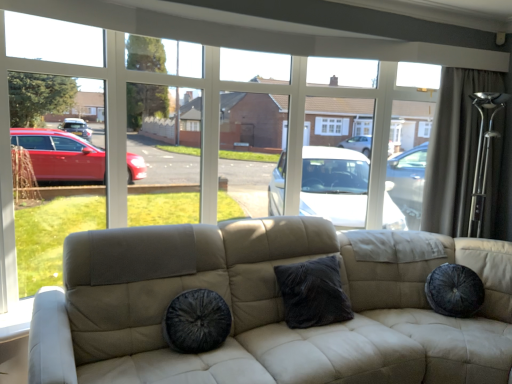
Find the location of a particular element. The height and width of the screenshot is (384, 512). velvet dark gray pillow at center is located at coordinates (313, 293).

The image size is (512, 384). I want to click on dark gray fabric curtain at upper right, so click(454, 149).

What do you see at coordinates (196, 321) in the screenshot? I see `velvet black dog bed at center` at bounding box center [196, 321].

This screenshot has width=512, height=384. In order to click on velvet dark gray pillow at center in this screenshot , I will do `click(313, 293)`.

Between dark gray fabric curtain at upper right and velvet black dog bed at center, which one has more height?

With more height is dark gray fabric curtain at upper right.

Does point (468, 129) appear closer or farther from the camera than point (211, 340)?

Point (468, 129).

Is point (448, 210) positioned after point (331, 291)?

Yes, it is.

Which of these two, dark gray fabric curtain at upper right or velvet dark gray pillow at center, stands shorter?

velvet dark gray pillow at center.

Based on their sizes in the image, would you say dark gray fabric curtain at upper right is bigger or smaller than velvet dark gray pillow at center?

Clearly, dark gray fabric curtain at upper right is larger in size than velvet dark gray pillow at center.

Is dark gray fabric curtain at upper right positioned with its back to velvet dark gray pillow at center?

No, dark gray fabric curtain at upper right is not facing the opposite direction of velvet dark gray pillow at center.

Is velvet dark gray pillow at center taller than dark gray fabric curtain at upper right?

No.

Is velvet dark gray pillow at center closer to the viewer compared to dark gray fabric curtain at upper right?

Yes, it is.

Who is smaller, velvet dark gray pillow at center or dark gray fabric curtain at upper right?

Smaller between the two is velvet dark gray pillow at center.

From the image's perspective, which is above, velvet black dog bed at center or dark gray fabric curtain at upper right?

From the image's view, dark gray fabric curtain at upper right is above.

Considering the positions of points (218, 320) and (424, 187), is point (218, 320) closer to camera compared to point (424, 187)?

Yes.

From the picture: Would you say dark gray fabric curtain at upper right is part of velvet black dog bed at center's contents?

That's incorrect, dark gray fabric curtain at upper right is not inside velvet black dog bed at center.

In terms of size, does velvet black dog bed at center appear bigger or smaller than dark gray fabric curtain at upper right?

Clearly, velvet black dog bed at center is smaller in size than dark gray fabric curtain at upper right.

Based on the photo, is velvet black dog bed at center inside velvet dark gray pillow at center?

That's incorrect, velvet black dog bed at center is not inside velvet dark gray pillow at center.

Is the position of velvet dark gray pillow at center more distant than that of velvet black dog bed at center?

Yes, it is.

Is velvet dark gray pillow at center aimed at velvet black dog bed at center?

No.

Locate an element on the screen. The image size is (512, 384). pillow on the right of velvet black dog bed at center is located at coordinates (313, 293).

Is the position of velvet black dog bed at center more distant than that of velvet dark gray pillow at center?

No, velvet black dog bed at center is closer to the camera.

The height and width of the screenshot is (384, 512). I want to click on pillow on the right of the velvet black dog bed at center, so click(x=313, y=293).

How different are the orientations of velvet black dog bed at center and velvet dark gray pillow at center in degrees?

There is a 3.92-degree angle between the facing directions of velvet black dog bed at center and velvet dark gray pillow at center.

This screenshot has width=512, height=384. I want to click on dog bed below the dark gray fabric curtain at upper right (from the image's perspective), so click(x=196, y=321).

The width and height of the screenshot is (512, 384). What are the coordinates of `curtain above the velvet dark gray pillow at center (from the image's perspective)` in the screenshot? It's located at (454, 149).

Estimate the real-world distances between objects in this image. Which object is closer to velvet black dog bed at center, dark gray fabric curtain at upper right or velvet dark gray pillow at center?

Based on the image, velvet dark gray pillow at center appears to be nearer to velvet black dog bed at center.

Looking at the image, which one is located further to velvet dark gray pillow at center, velvet black dog bed at center or dark gray fabric curtain at upper right?

dark gray fabric curtain at upper right is further to velvet dark gray pillow at center.

Which object lies further to the anchor point dark gray fabric curtain at upper right, velvet dark gray pillow at center or velvet black dog bed at center?

velvet black dog bed at center is positioned further to the anchor dark gray fabric curtain at upper right.

From the image, which object appears to be nearer to velvet dark gray pillow at center, dark gray fabric curtain at upper right or velvet black dog bed at center?

velvet black dog bed at center is closer to velvet dark gray pillow at center.

Considering their positions, is velvet black dog bed at center positioned closer to dark gray fabric curtain at upper right than velvet dark gray pillow at center?

Among the two, velvet dark gray pillow at center is located nearer to dark gray fabric curtain at upper right.

From the image, which object appears to be nearer to velvet black dog bed at center, velvet dark gray pillow at center or dark gray fabric curtain at upper right?

velvet dark gray pillow at center is positioned closer to the anchor velvet black dog bed at center.

Find the location of `pillow between velvet black dog bed at center and dark gray fabric curtain at upper right from left to right`. pillow between velvet black dog bed at center and dark gray fabric curtain at upper right from left to right is located at coordinates (313, 293).